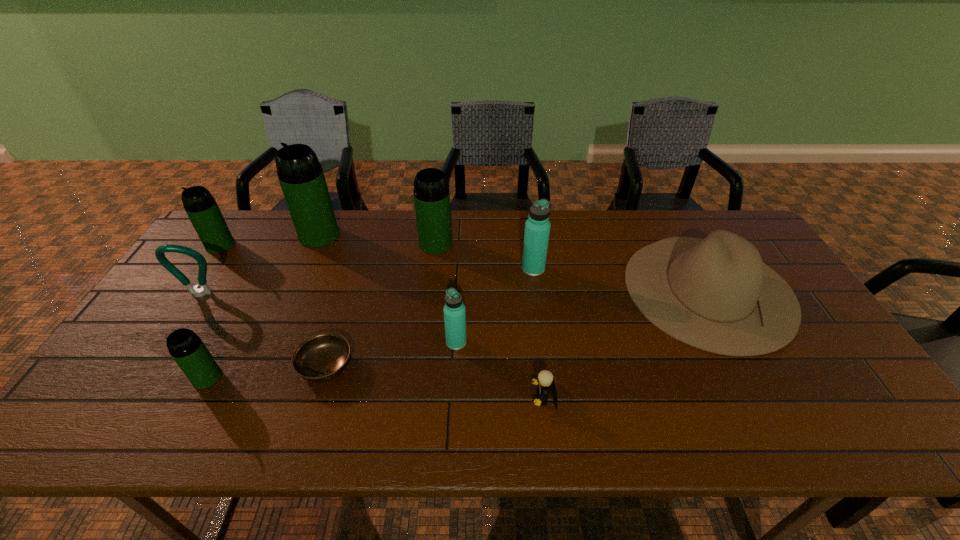
Locate an element on the screen. Image resolution: width=960 pixels, height=540 pixels. object that is the nearest to the bigger aqua thermos bottle is located at coordinates (431, 191).

Locate an element on the screen. The height and width of the screenshot is (540, 960). thermos bottle that stands as the closest to the fifth shortest thermos bottle is located at coordinates (537, 228).

Identify the location of the closest thermos bottle to the third thermos bottle from left to right. The height and width of the screenshot is (540, 960). (200, 206).

The width and height of the screenshot is (960, 540). I want to click on green thermos bottle that can be found as the fourth closest to the right aqua thermos bottle, so click(200, 206).

This screenshot has width=960, height=540. In order to click on green thermos bottle object that ranks as the closest to the third thermos bottle from left to right in this screenshot , I will do `click(200, 206)`.

At what (x,y) coordinates should I click in order to perform the action: click on free spot that satisfies the following two spatial constraints: 1. on the back side of the rightmost object; 2. on the right side of the sixth object from right to left. Please return your answer as a coordinate pair (x, y). This screenshot has height=540, width=960. Looking at the image, I should click on pos(349,289).

You are a GUI agent. You are given a task and a screenshot of the screen. Output one action in this format:
    pyautogui.click(x=<x>, y=<y>)
    Task: Click on the vacant space that satisfies the following two spatial constraints: 1. from the spout of the fourth object from left to right; 2. on the left side of the brown sombrero
    
    Given the screenshot: What is the action you would take?
    (296, 289)

Identify the location of vacant space that satisfies the following two spatial constraints: 1. at the jaws of the seventh object from left to right; 2. on the left side of the bottle opener. The width and height of the screenshot is (960, 540). (169, 342).